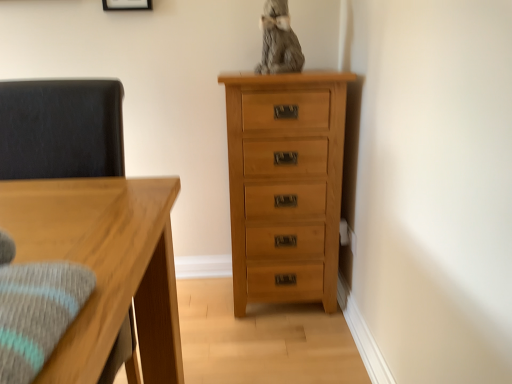
Question: From the image's perspective, is matte white picture frame at upper center below natural wood chest of drawers at right?

Choices:
 (A) yes
 (B) no

Answer: (B)

Question: Is matte white picture frame at upper center oriented away from natural wood chest of drawers at right?

Choices:
 (A) yes
 (B) no

Answer: (B)

Question: From a real-world perspective, is matte white picture frame at upper center located beneath natural wood chest of drawers at right?

Choices:
 (A) yes
 (B) no

Answer: (B)

Question: Is matte white picture frame at upper center bigger than natural wood chest of drawers at right?

Choices:
 (A) no
 (B) yes

Answer: (A)

Question: From a real-world perspective, does matte white picture frame at upper center stand above natural wood chest of drawers at right?

Choices:
 (A) no
 (B) yes

Answer: (B)

Question: In terms of height, does dark gray fabric swivel chair at left look taller or shorter compared to matte white picture frame at upper center?

Choices:
 (A) tall
 (B) short

Answer: (A)

Question: Would you say dark gray fabric swivel chair at left is inside or outside matte white picture frame at upper center?

Choices:
 (A) inside
 (B) outside

Answer: (B)

Question: Considering the positions of point (96, 175) and point (137, 3), is point (96, 175) closer or farther from the camera than point (137, 3)?

Choices:
 (A) closer
 (B) farther

Answer: (A)

Question: From the image's perspective, is dark gray fabric swivel chair at left positioned above or below matte white picture frame at upper center?

Choices:
 (A) below
 (B) above

Answer: (A)

Question: Would you say natural wood chest of drawers at right is to the left or to the right of dark gray fabric swivel chair at left in the picture?

Choices:
 (A) left
 (B) right

Answer: (B)

Question: Is natural wood chest of drawers at right taller or shorter than dark gray fabric swivel chair at left?

Choices:
 (A) tall
 (B) short

Answer: (A)

Question: From a real-world perspective, is natural wood chest of drawers at right above or below dark gray fabric swivel chair at left?

Choices:
 (A) below
 (B) above

Answer: (A)

Question: Is natural wood chest of drawers at right spatially inside dark gray fabric swivel chair at left, or outside of it?

Choices:
 (A) inside
 (B) outside

Answer: (B)

Question: From a real-world perspective, is natural wood chest of drawers at right physically located above or below matte white picture frame at upper center?

Choices:
 (A) above
 (B) below

Answer: (B)

Question: From the image's perspective, is natural wood chest of drawers at right positioned above or below matte white picture frame at upper center?

Choices:
 (A) below
 (B) above

Answer: (A)